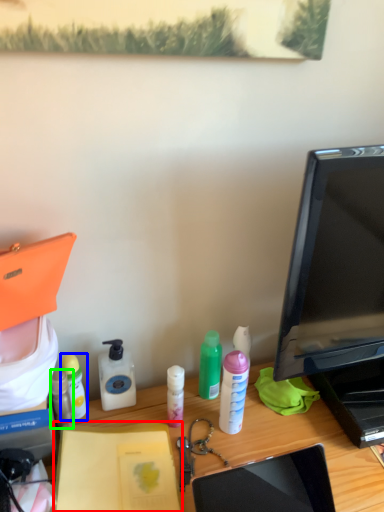
Question: Which object is positioned closest to notebook (highlighted by a red box)? Select from bottle (highlighted by a blue box) and bottle (highlighted by a green box).

Choices:
 (A) bottle
 (B) bottle

Answer: (B)